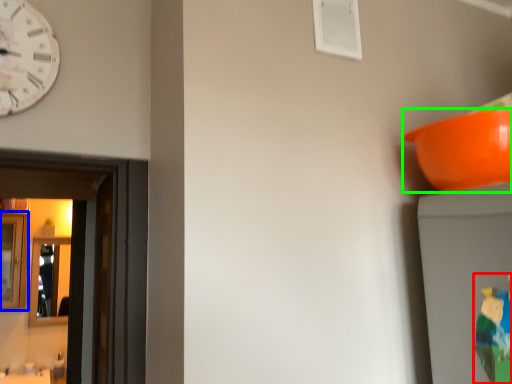
Question: Which is farther away from toy (highlighted by a red box)? mirror (highlighted by a blue box) or bowl (highlighted by a green box)?

Choices:
 (A) mirror
 (B) bowl

Answer: (A)